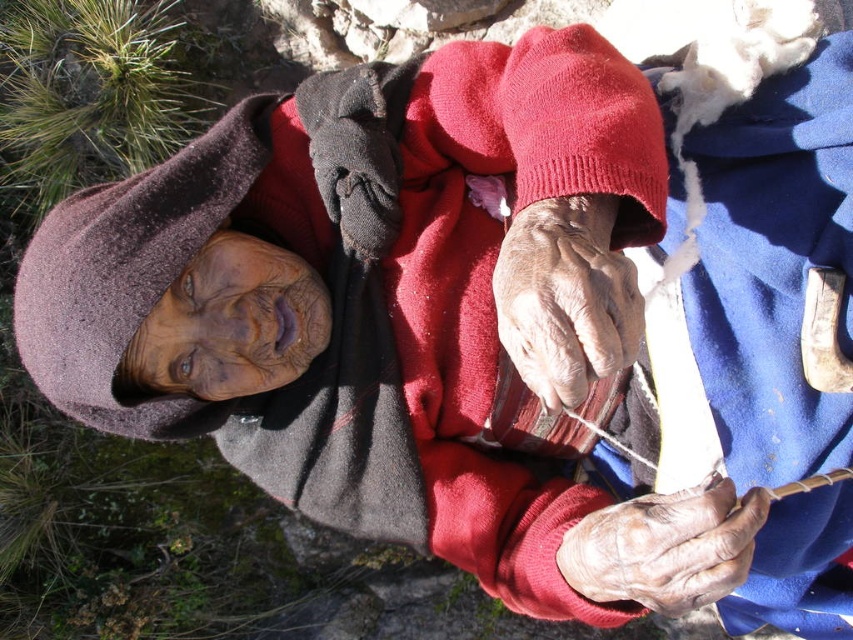
You are standing in front of the elderly person in the image. There are two points marked in the scene. The first point is at coordinate point (585,241) and the second is at point (665,604). Which point is closer to you?

Point (585,241) is closer to the camera than point (665,604), so the first point is closer to you.

You are a photographer trying to capture the elderly person in the scene. You notice two areas of dry skin on their hands. Which area, the dry skin at center or the dry skin at lower right, is closer to the camera?

The dry skin at center is closer to the camera because it is in front of the dry skin at lower right.